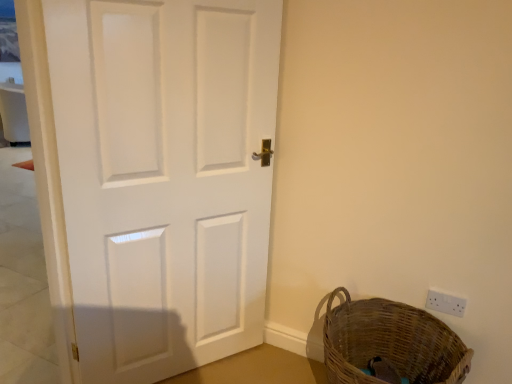
Question: Is point (437, 306) positioned closer to the camera than point (464, 362)?

Choices:
 (A) farther
 (B) closer

Answer: (A)

Question: Looking at the image, does white plastic electric outlet at lower right seem bigger or smaller compared to woven brown basket at lower right?

Choices:
 (A) big
 (B) small

Answer: (B)

Question: Which object is the closest to the woven brown basket at lower right?

Choices:
 (A) white plastic electric outlet at lower right
 (B) white matte door at center

Answer: (A)

Question: Estimate the real-world distances between objects in this image. Which object is closer to the white plastic electric outlet at lower right?

Choices:
 (A) woven brown basket at lower right
 (B) white matte door at center

Answer: (A)